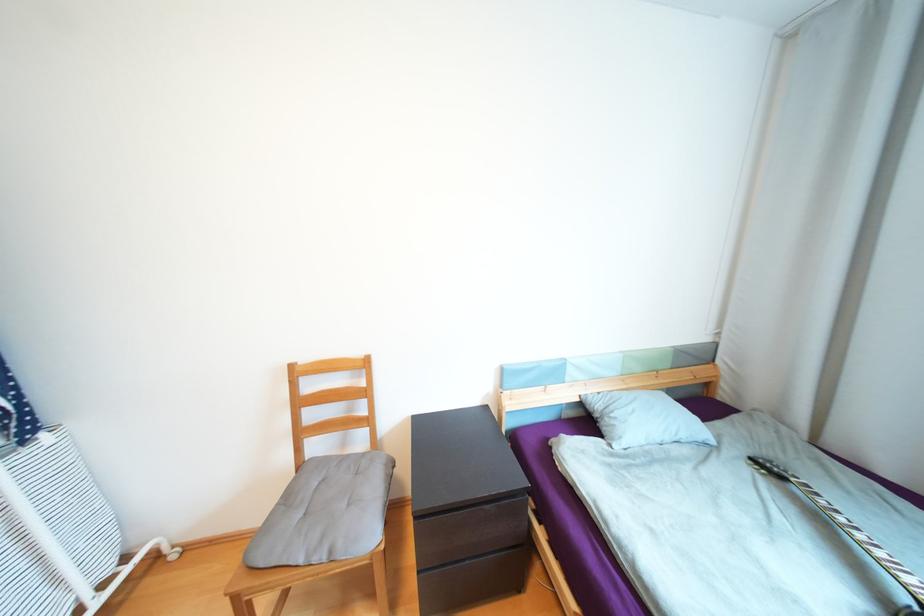
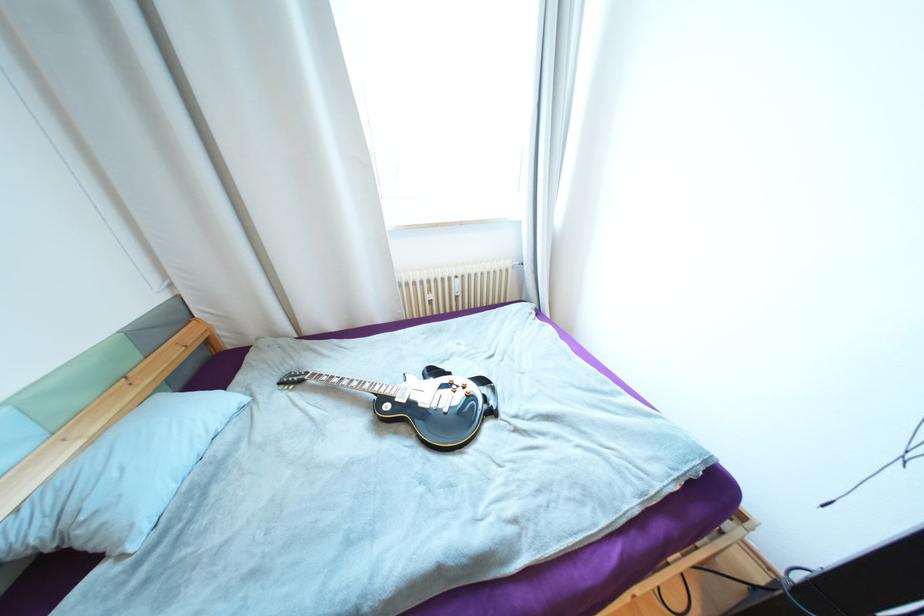
The point at (618, 423) is marked in the first image. Where is the corresponding point in the second image?

(101, 525)